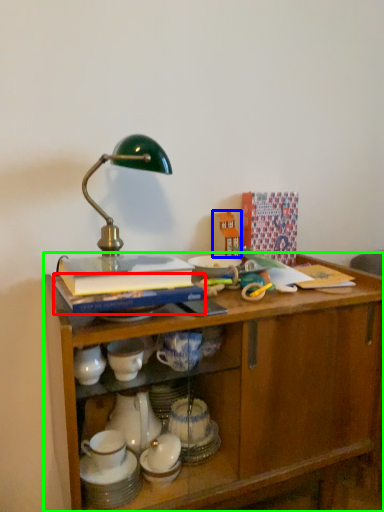
Question: Based on their relative distances, which object is nearer to book (highlighted by a red box)? Choose from toy (highlighted by a blue box) and desk (highlighted by a green box).

Choices:
 (A) toy
 (B) desk

Answer: (B)